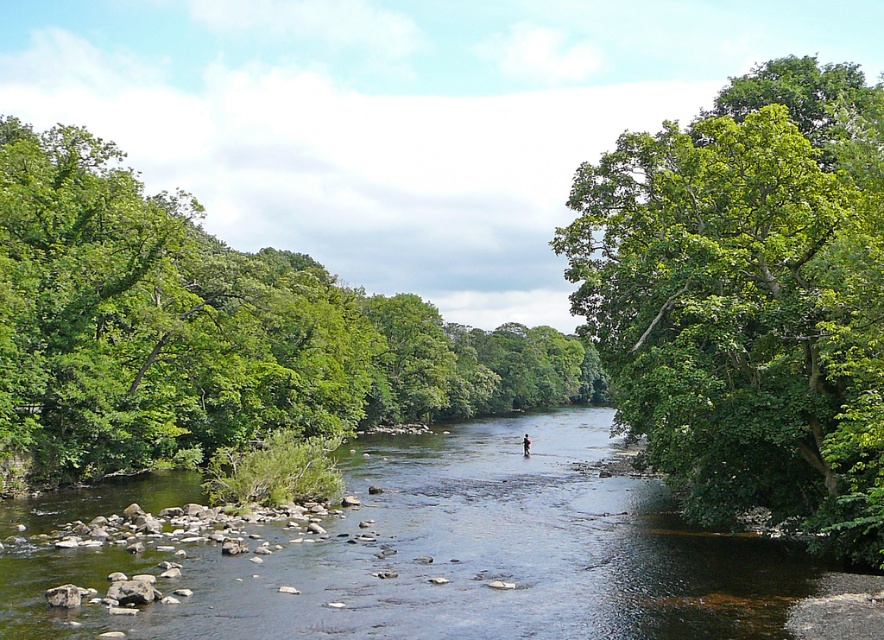
You are a hiker who wants to cross the river using a bridge that is 160 feet long. You see the green leafy tree at center and the clear water at center. Can you safely cross the river using this bridge?

The green leafy tree at center and clear water at center are 167.50 feet apart. The bridge is 160 feet long, which is shorter than the distance between them. Therefore, the bridge is not long enough to safely cross between the green leafy tree at center and the clear water at center.